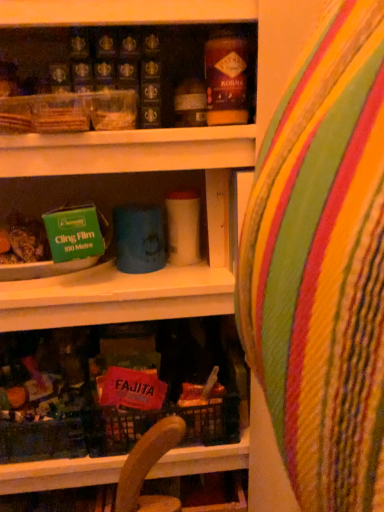
This screenshot has height=512, width=384. Describe the element at coordinates (226, 79) in the screenshot. I see `matte brown jar at upper center` at that location.

You are a GUI agent. You are given a task and a screenshot of the screen. Output one action in this format:
    pyautogui.click(x=<x>, y=<y>)
    Task: Click on the matte brown jar at upper center
    This screenshot has width=384, height=512.
    Given the screenshot: What is the action you would take?
    pyautogui.click(x=226, y=79)

Identify the location of multicolored striped bean bag chair at center. (322, 266).

What do you see at coordinates (322, 266) in the screenshot?
I see `multicolored striped bean bag chair at center` at bounding box center [322, 266].

This screenshot has width=384, height=512. Identify the location of matte brown jar at upper center. pos(226,79).

Is matte brown jar at upper center to the left of multicolored striped bean bag chair at center from the viewer's perspective?

Yes.

Relative to multicolored striped bean bag chair at center, is matte brown jar at upper center in front or behind?

Clearly, matte brown jar at upper center is behind multicolored striped bean bag chair at center.

Does point (211, 56) appear closer or farther from the camera than point (326, 385)?

Point (211, 56).

From the image's perspective, relative to multicolored striped bean bag chair at center, is matte brown jar at upper center above or below?

matte brown jar at upper center is above multicolored striped bean bag chair at center.

From a real-world perspective, does matte brown jar at upper center sit lower than multicolored striped bean bag chair at center?

Actually, matte brown jar at upper center is physically above multicolored striped bean bag chair at center in the real world.

Considering the sizes of matte brown jar at upper center and multicolored striped bean bag chair at center in the image, is matte brown jar at upper center wider or thinner than multicolored striped bean bag chair at center?

Clearly, matte brown jar at upper center has less width compared to multicolored striped bean bag chair at center.

Can you confirm if matte brown jar at upper center is taller than multicolored striped bean bag chair at center?

No, matte brown jar at upper center is not taller than multicolored striped bean bag chair at center.

Is matte brown jar at upper center bigger or smaller than multicolored striped bean bag chair at center?

Considering their sizes, matte brown jar at upper center takes up less space than multicolored striped bean bag chair at center.

Is multicolored striped bean bag chair at center a part of matte brown jar at upper center?

No, multicolored striped bean bag chair at center is located outside of matte brown jar at upper center.

Would you say matte brown jar at upper center is a long distance from multicolored striped bean bag chair at center?

No, matte brown jar at upper center is in close proximity to multicolored striped bean bag chair at center.

Is matte brown jar at upper center aimed at multicolored striped bean bag chair at center?

Yes.

What's the angular difference between matte brown jar at upper center and multicolored striped bean bag chair at center's facing directions?

The facing directions of matte brown jar at upper center and multicolored striped bean bag chair at center are 87.2 degrees apart.

This screenshot has height=512, width=384. Find the location of `bean bag chair on the right of the matte brown jar at upper center`. bean bag chair on the right of the matte brown jar at upper center is located at coordinates (322, 266).

Considering the positions of objects multicolored striped bean bag chair at center and matte brown jar at upper center in the image provided, who is more to the right, multicolored striped bean bag chair at center or matte brown jar at upper center?

multicolored striped bean bag chair at center.

Is the position of multicolored striped bean bag chair at center more distant than that of matte brown jar at upper center?

No, multicolored striped bean bag chair at center is in front of matte brown jar at upper center.

Considering the positions of points (291, 418) and (234, 108), is point (291, 418) farther from camera compared to point (234, 108)?

That is False.

From the image's perspective, would you say multicolored striped bean bag chair at center is shown under matte brown jar at upper center?

Yes.

From a real-world perspective, is multicolored striped bean bag chair at center above or below matte brown jar at upper center?

multicolored striped bean bag chair at center is situated lower than matte brown jar at upper center in the real world.

Does multicolored striped bean bag chair at center have a greater width compared to matte brown jar at upper center?

Yes, multicolored striped bean bag chair at center is wider than matte brown jar at upper center.

Does multicolored striped bean bag chair at center have a lesser height compared to matte brown jar at upper center?

No, multicolored striped bean bag chair at center is not shorter than matte brown jar at upper center.

Can you confirm if multicolored striped bean bag chair at center is bigger than matte brown jar at upper center?

Yes.

Is multicolored striped bean bag chair at center spatially inside matte brown jar at upper center, or outside of it?

multicolored striped bean bag chair at center is not enclosed by matte brown jar at upper center.

Is multicolored striped bean bag chair at center not close to matte brown jar at upper center?

No, multicolored striped bean bag chair at center is not far away from matte brown jar at upper center.

Could you tell me if multicolored striped bean bag chair at center is facing matte brown jar at upper center?

No, multicolored striped bean bag chair at center is not aimed at matte brown jar at upper center.

How many degrees apart are the facing directions of multicolored striped bean bag chair at center and matte brown jar at upper center?

There is a 87.2-degree angle between the facing directions of multicolored striped bean bag chair at center and matte brown jar at upper center.

Find the location of a particular element. This screenshot has height=512, width=384. yoghurt that appears behind the multicolored striped bean bag chair at center is located at coordinates (226, 79).

Locate an element on the screen. The image size is (384, 512). yoghurt above the multicolored striped bean bag chair at center (from a real-world perspective) is located at coordinates (226, 79).

Locate an element on the screen. The height and width of the screenshot is (512, 384). bean bag chair that is on the right side of matte brown jar at upper center is located at coordinates (322, 266).